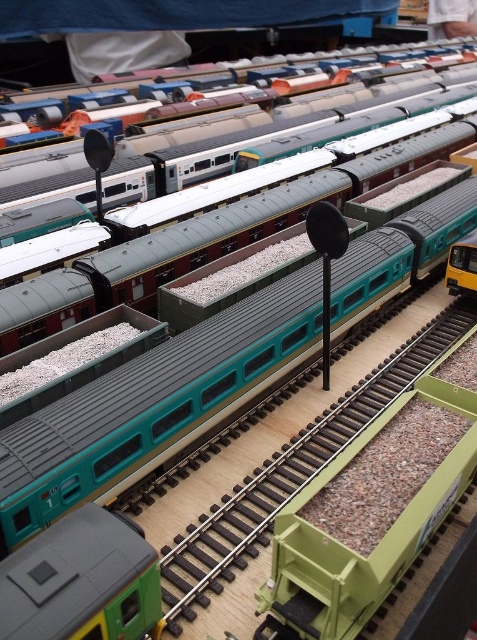
Question: Is green rubber train track at center smaller than green matte train car at bottom left?

Choices:
 (A) no
 (B) yes

Answer: (A)

Question: Can you confirm if green rubber train track at center is smaller than green matte train car at bottom left?

Choices:
 (A) no
 (B) yes

Answer: (A)

Question: Among these points, which one is farthest from the camera?

Choices:
 (A) (82, 522)
 (B) (263, 536)

Answer: (B)

Question: Which point is farther from the camera taking this photo?

Choices:
 (A) click(x=292, y=456)
 (B) click(x=113, y=600)

Answer: (A)

Question: Can you confirm if green rubber train track at center is positioned below green matte train car at bottom left?

Choices:
 (A) no
 (B) yes

Answer: (A)